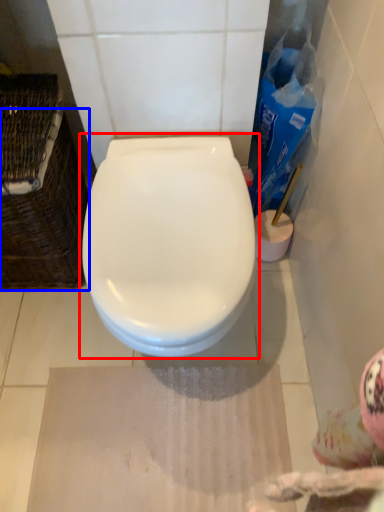
Question: Which object appears closest to the camera in this image, toilet (highlighted by a red box) or basket (highlighted by a blue box)?

Choices:
 (A) toilet
 (B) basket

Answer: (A)